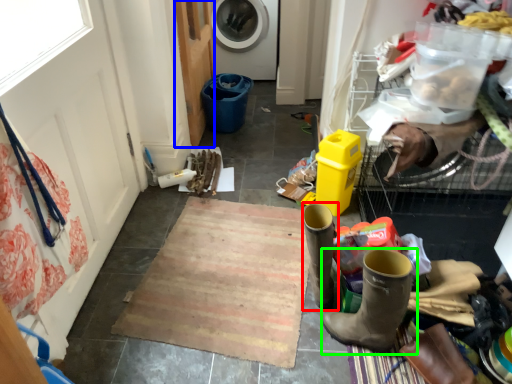
Question: Considering the real-world distances, which object is closest to footwear (highlighted by a red box)? screen door (highlighted by a blue box) or footwear (highlighted by a green box).

Choices:
 (A) screen door
 (B) footwear

Answer: (B)